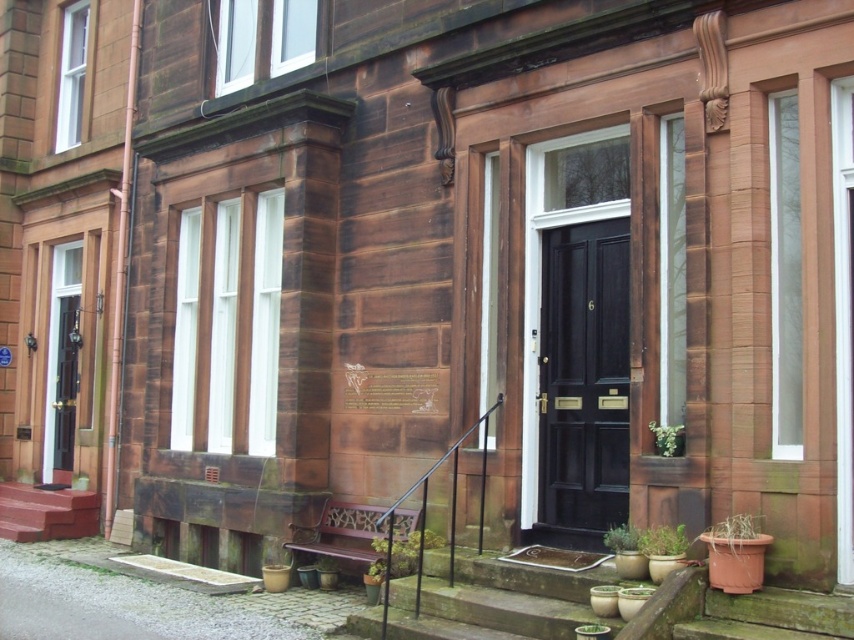
Question: Which of the following is the farthest from the observer?

Choices:
 (A) green leafy plant at bottom center
 (B) smooth red stairs at lower left

Answer: (B)

Question: In this image, where is brown clay pot at lower right located relative to green leafy plant at center?

Choices:
 (A) below
 (B) above

Answer: (A)

Question: Estimate the real-world distances between objects in this image. Which object is closer to the green matte plant at lower center?

Choices:
 (A) green matte plant at lower right
 (B) black glossy door at center
 (C) smooth red stairs at lower left

Answer: (A)

Question: Does black glossy door at center appear on the right side of green leafy plant at center?

Choices:
 (A) no
 (B) yes

Answer: (A)

Question: In this image, where is black glossy door at center located relative to green leafy plant at bottom center?

Choices:
 (A) right
 (B) left

Answer: (A)

Question: Which point is closer to the camera?

Choices:
 (A) (610, 266)
 (B) (375, 561)
 (C) (718, 528)

Answer: (C)